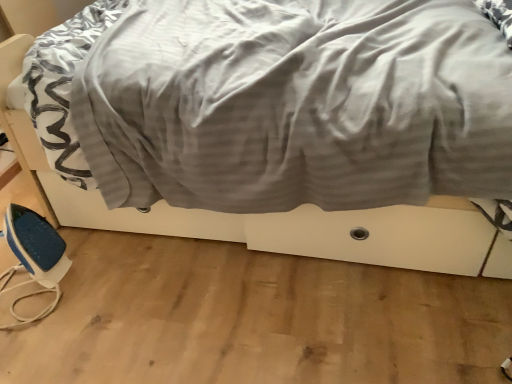
Question: Does white fabric bed at center have a lesser height compared to blue plastic iron at lower left?

Choices:
 (A) yes
 (B) no

Answer: (B)

Question: Considering the relative positions of white fabric bed at center and blue plastic iron at lower left in the image provided, is white fabric bed at center to the left of blue plastic iron at lower left from the viewer's perspective?

Choices:
 (A) yes
 (B) no

Answer: (B)

Question: Is white fabric bed at center smaller than blue plastic iron at lower left?

Choices:
 (A) no
 (B) yes

Answer: (A)

Question: Considering the relative sizes of white fabric bed at center and blue plastic iron at lower left in the image provided, is white fabric bed at center wider than blue plastic iron at lower left?

Choices:
 (A) no
 (B) yes

Answer: (B)

Question: Does white fabric bed at center have a larger size compared to blue plastic iron at lower left?

Choices:
 (A) no
 (B) yes

Answer: (B)

Question: Does white fabric bed at center turn towards blue plastic iron at lower left?

Choices:
 (A) yes
 (B) no

Answer: (B)

Question: From the image's perspective, would you say blue plastic iron at lower left is positioned over white fabric bed at center?

Choices:
 (A) yes
 (B) no

Answer: (B)

Question: Is blue plastic iron at lower left far from white fabric bed at center?

Choices:
 (A) yes
 (B) no

Answer: (B)

Question: From a real-world perspective, is blue plastic iron at lower left on top of white fabric bed at center?

Choices:
 (A) yes
 (B) no

Answer: (B)

Question: Is blue plastic iron at lower left closer to the viewer compared to white fabric bed at center?

Choices:
 (A) yes
 (B) no

Answer: (B)

Question: From a real-world perspective, is blue plastic iron at lower left beneath white fabric bed at center?

Choices:
 (A) yes
 (B) no

Answer: (A)

Question: Could you tell me if blue plastic iron at lower left is facing white fabric bed at center?

Choices:
 (A) no
 (B) yes

Answer: (A)

Question: Considering the positions of point (94, 44) and point (15, 233), is point (94, 44) closer or farther from the camera than point (15, 233)?

Choices:
 (A) closer
 (B) farther

Answer: (B)